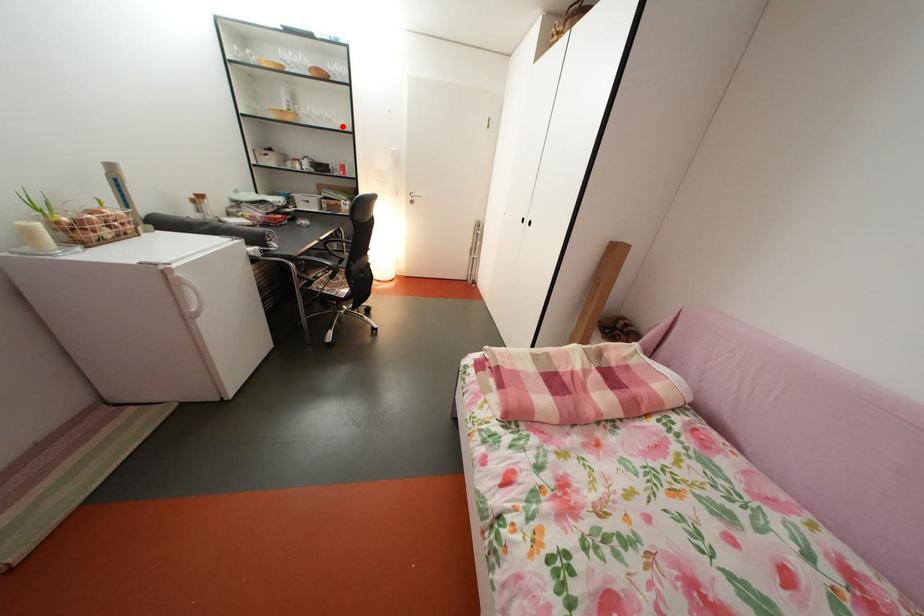
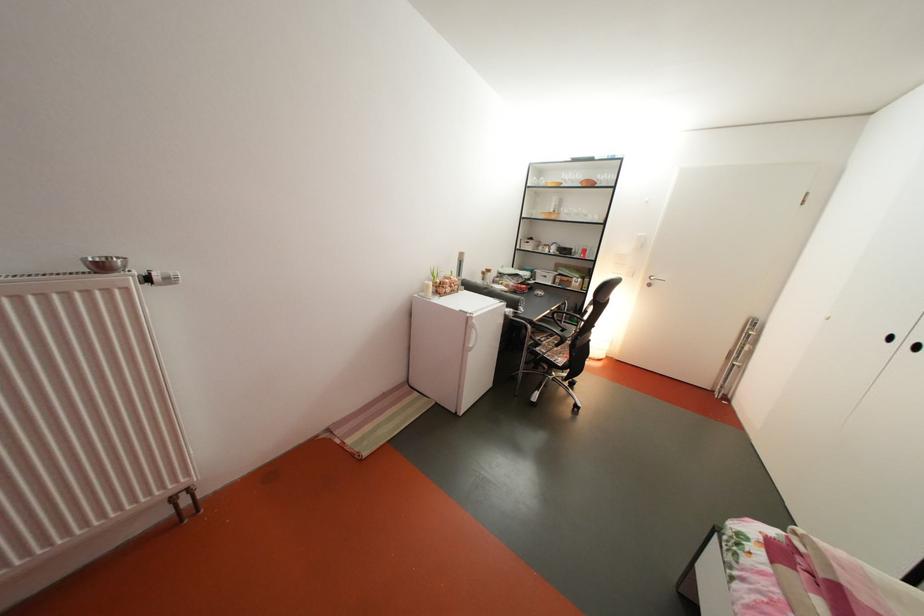
Question: I am providing you with two images of the same scene from different viewpoints. Image1 has a red point marked. In image2, the corresponding 3D location appears at what relative position? Reply with the corresponding letter.

Choices:
 (A) Closer
 (B) Farther

Answer: (A)